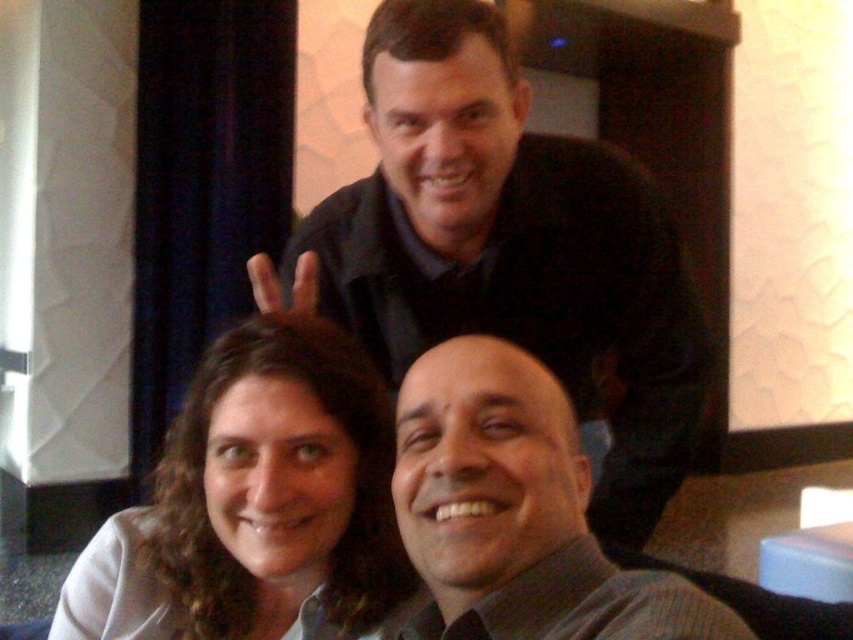
You are trying to decide whether to place a rectangular decorative plaque on the wall behind the matte black jacket at upper center or the curly brown hair at lower left. Which location has enough space to accommodate the plaque without overlapping either object?

The matte black jacket at upper center has a greater width than the curly brown hair at lower left, so placing the plaque behind the matte black jacket at upper center would provide more space and avoid overlapping.

You are standing in the room and want to reach the point marked as point [419,444]. If your arm can extend 24 inches, can you touch it without moving your feet?

The point [419,444] is 26.76 inches away from you. Since your arm can only extend 24 inches, you cannot touch it without moving your feet.